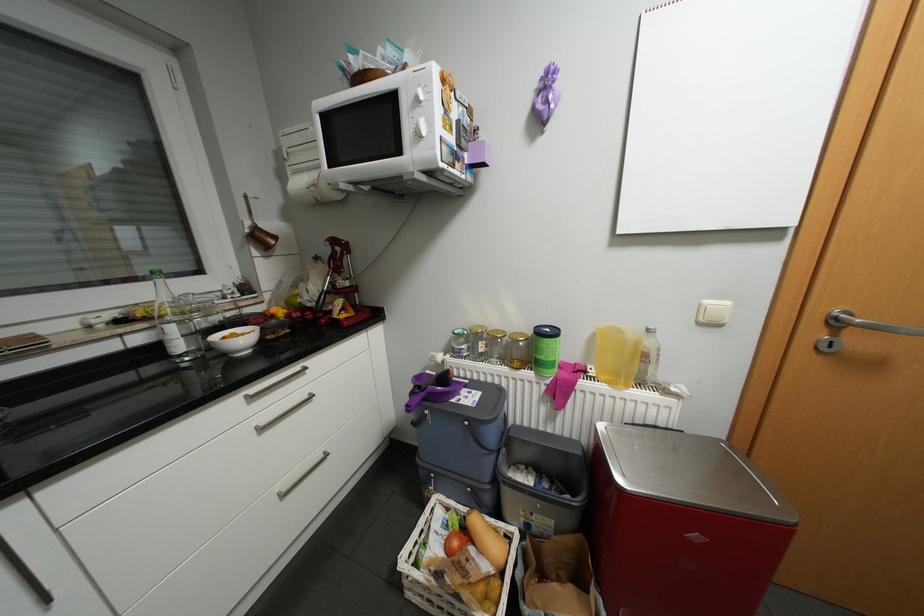
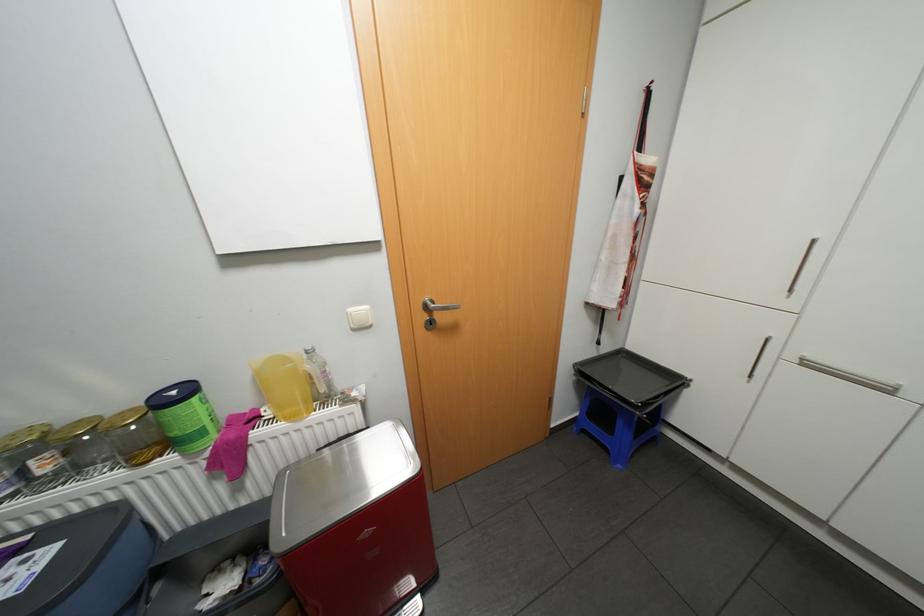
Question: The first image is from the beginning of the video and the second image is from the end. How did the camera likely rotate when shooting the video?

Choices:
 (A) Left
 (B) Right
 (C) Up
 (D) Down

Answer: (B)